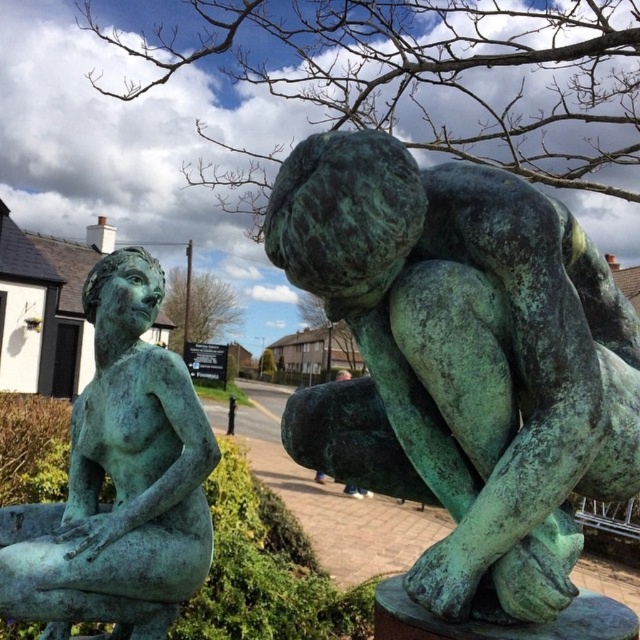
Measure the distance between green patina statue at center and camera.

green patina statue at center and camera are 3.88 feet apart from each other.

Based on the photo, who is positioned more to the right, green patina statue at center or green patina statue at left?

From the viewer's perspective, green patina statue at center appears more on the right side.

Is point (484, 577) positioned behind point (122, 324)?

That is False.

This screenshot has height=640, width=640. Identify the location of green patina statue at center. (472, 355).